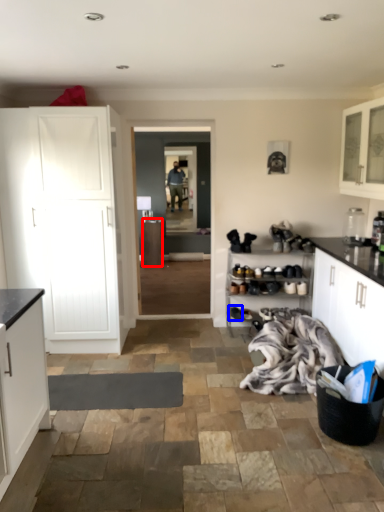
Question: Which of the following is the closest to the observer, cabinetry (highlighted by a red box) or footwear (highlighted by a blue box)?

Choices:
 (A) cabinetry
 (B) footwear

Answer: (B)